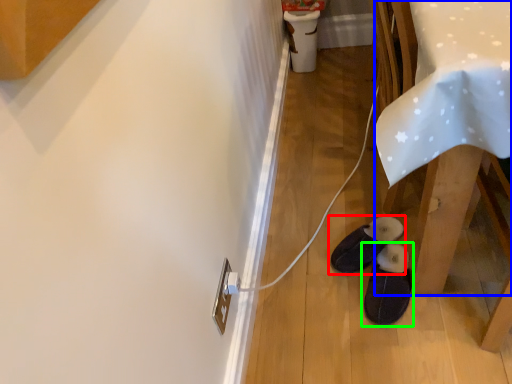
Question: Which object is the farthest from footwear (highlighted by a red box)? Choose among these: table (highlighted by a blue box) or footwear (highlighted by a green box).

Choices:
 (A) table
 (B) footwear

Answer: (A)